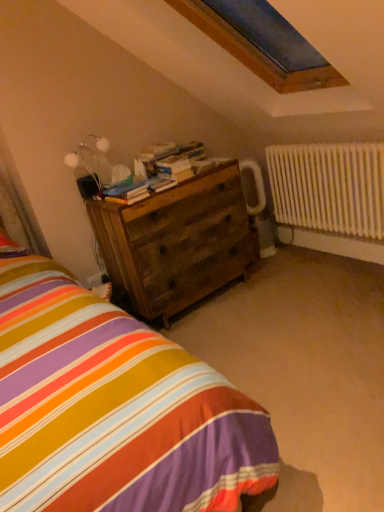
Where is `vacant space to the right of wooden chest of drawers at center`? This screenshot has width=384, height=512. vacant space to the right of wooden chest of drawers at center is located at coordinates (284, 285).